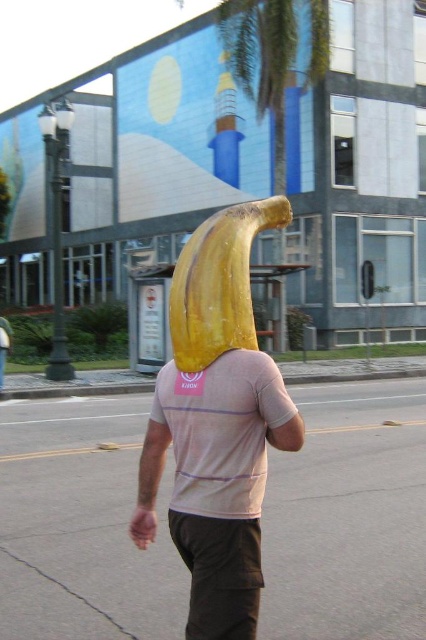
Question: In this image, where is yellow rubber banana at center located relative to yellow matte banana at center?

Choices:
 (A) right
 (B) left

Answer: (A)

Question: Does yellow rubber banana at center lie behind yellow matte banana at center?

Choices:
 (A) no
 (B) yes

Answer: (A)

Question: Does yellow rubber banana at center lie behind yellow matte banana at center?

Choices:
 (A) no
 (B) yes

Answer: (A)